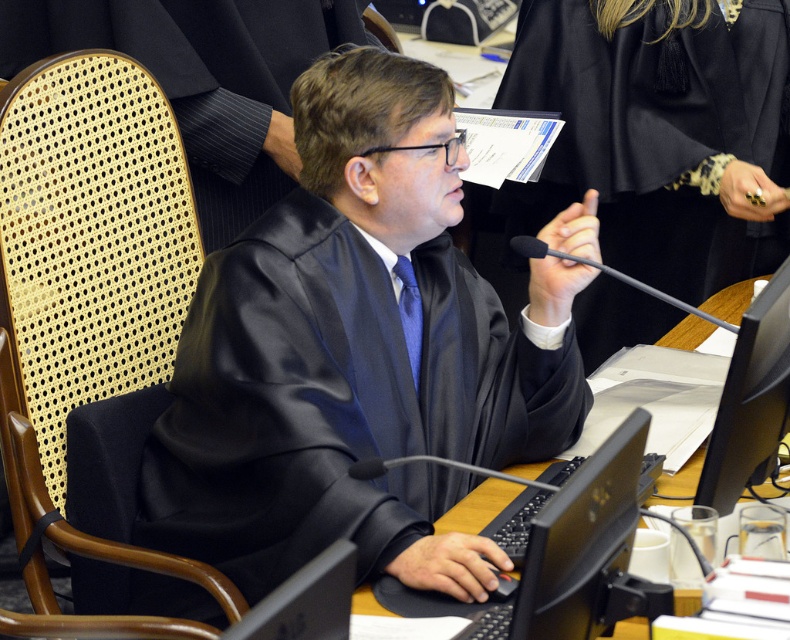
Can you confirm if matte black robe at center is bigger than black satin robe at center?

Yes, matte black robe at center is bigger than black satin robe at center.

How far apart are matte black robe at center and black satin robe at center?

matte black robe at center and black satin robe at center are 36.80 inches apart from each other.

Between point (604, 17) and point (138, 45), which one is positioned behind?

The point (604, 17) is behind.

Locate an element on the screen. matte black robe at center is located at coordinates (657, 129).

Which of these two, satin black robe at center or black satin robe at center, stands taller?

Standing taller between the two is satin black robe at center.

Between satin black robe at center and black satin robe at center, which one appears on the left side from the viewer's perspective?

black satin robe at center is more to the left.

Which is in front, point (198, 547) or point (254, 205)?

Point (198, 547) is more forward.

What are the coordinates of `satin black robe at center` in the screenshot? It's located at (337, 401).

Which is in front, point (570, 634) or point (713, 432)?

Point (570, 634)

Does black glossy laptop at center have a greater width compared to black glossy monitor at lower right?

Yes.

Does point (642, 429) come farther from viewer compared to point (783, 356)?

No.

Image resolution: width=790 pixels, height=640 pixels. What are the coordinates of `black glossy laptop at center` in the screenshot? It's located at (582, 554).